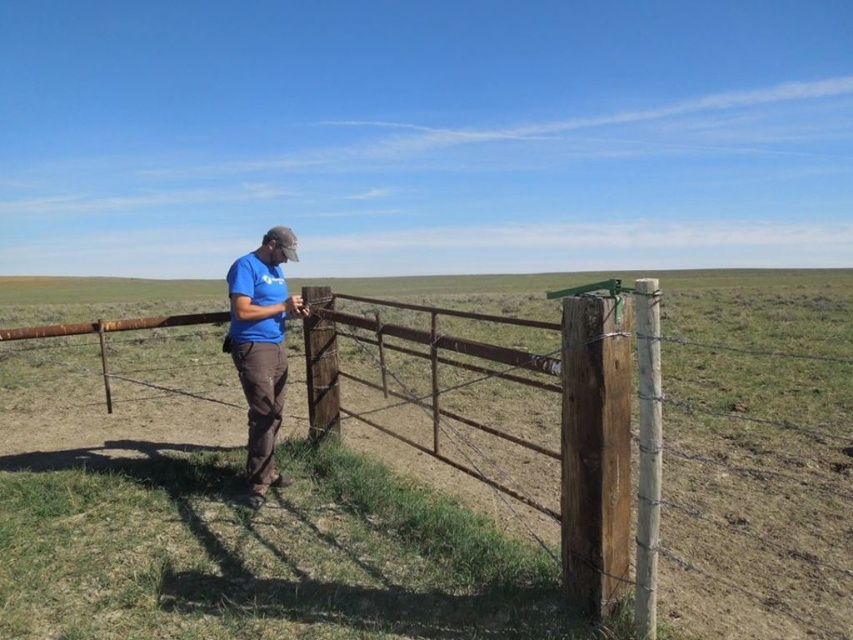
You are a surveyor trying to locate the rusty metal fence at center in a rural area. Given the coordinates provided, can you determine its exact location relative to the person?

The rusty metal fence at center is located at coordinates point (210,513), which places it to the right and slightly above the person in the image.

You are a photographer aiming to capture the rusty metal fence at center and the blue cotton shirt at center in a single shot. Based on their positions, can you determine which object will appear closer to the camera in the photo?

The rusty metal fence at center is located above the blue cotton shirt at center, so in the photo, the blue cotton shirt at center will appear closer to the camera since it is positioned lower in the frame.